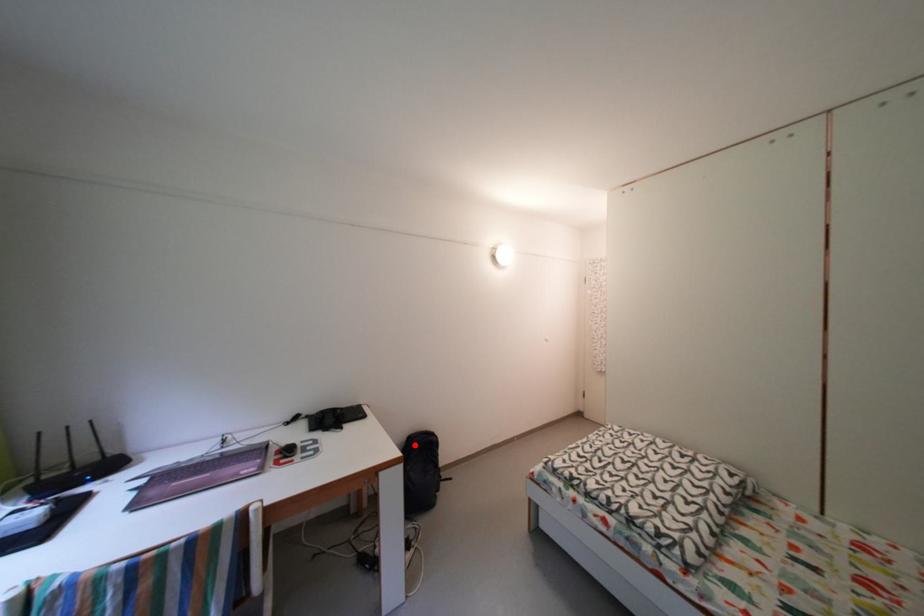
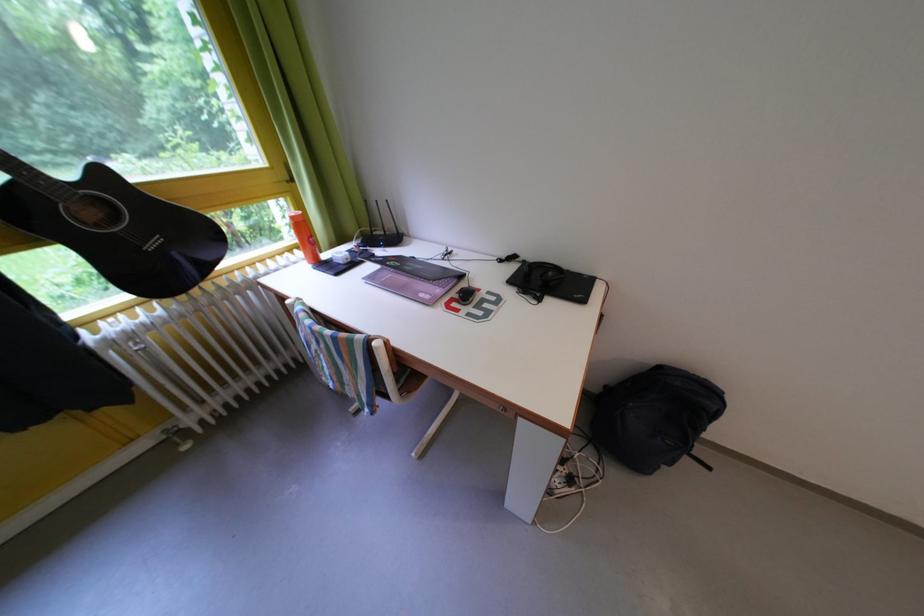
Question: I am providing you with two images of the same scene from different viewpoints. A red point is marked on the first image. At the location where the point appears in image 1, is it still visible in image 2?

Choices:
 (A) Yes
 (B) No

Answer: (A)